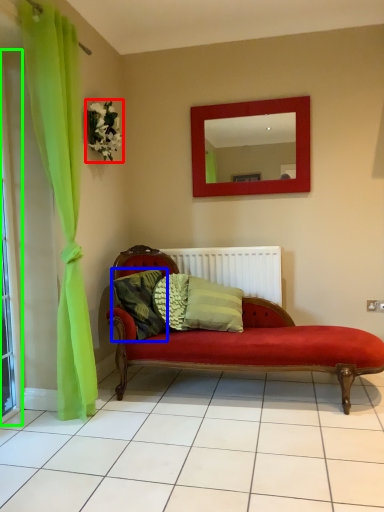
Question: Which object is positioned closest to flower (highlighted by a red box)? Select from pillow (highlighted by a blue box) and window frame (highlighted by a green box).

Choices:
 (A) pillow
 (B) window frame

Answer: (B)